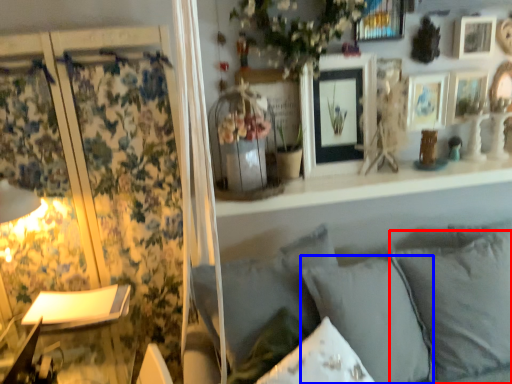
Question: Which object is closer to the camera taking this photo, pillow (highlighted by a red box) or pillow (highlighted by a blue box)?

Choices:
 (A) pillow
 (B) pillow

Answer: (B)